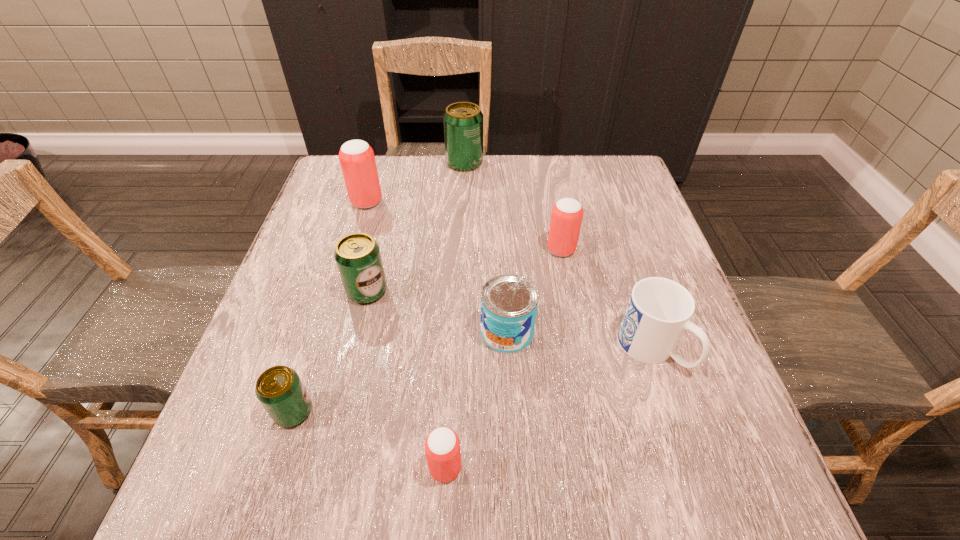
The image size is (960, 540). Identify the location of vacant space at the near left corner of the desktop. (241, 457).

You are a GUI agent. You are given a task and a screenshot of the screen. Output one action in this format:
    pyautogui.click(x=<x>, y=<y>)
    Task: Click on the free area in between the smallest red beer can and the can
    This screenshot has width=960, height=540.
    Given the screenshot: What is the action you would take?
    pyautogui.click(x=476, y=400)

This screenshot has width=960, height=540. In order to click on free space between the blue mug and the nearest object in this screenshot , I will do `click(548, 408)`.

At what (x,y) coordinates should I click in order to perform the action: click on free spot between the farthest beer can and the seventh nearest object. Please return your answer as a coordinate pair (x, y). Looking at the image, I should click on (416, 183).

Identify the location of free space between the second farthest object and the biggest green beer can. tap(416, 183).

In order to click on free spot between the can and the seventh farthest object in this screenshot , I will do `click(400, 372)`.

At what (x,y) coordinates should I click in order to perform the action: click on free space between the leftmost green beer can and the mug. Please return your answer as a coordinate pair (x, y). Image resolution: width=960 pixels, height=540 pixels. Looking at the image, I should click on (472, 380).

Identify which object is located as the fifth nearest to the farthest object. Please provide its 2D coordinates. Your answer should be formatted as a tuple, i.e. [(x, y)], where the tuple contains the x and y coordinates of a point satisfying the conditions above.

[(659, 310)]

The image size is (960, 540). What are the coordinates of `object that is the sixth nearest to the smallest green beer can` in the screenshot? It's located at (566, 218).

Identify which beer can is the fifth nearest to the third farthest beer can. Please provide its 2D coordinates. Your answer should be formatted as a tuple, i.e. [(x, y)], where the tuple contains the x and y coordinates of a point satisfying the conditions above.

[(279, 389)]